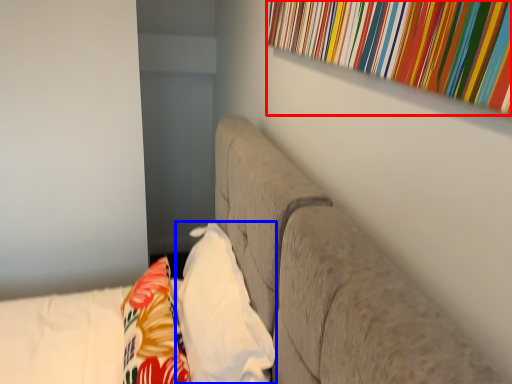
Question: Which point is further to the camera, curtain (highlighted by a red box) or pillow (highlighted by a blue box)?

Choices:
 (A) curtain
 (B) pillow

Answer: (B)